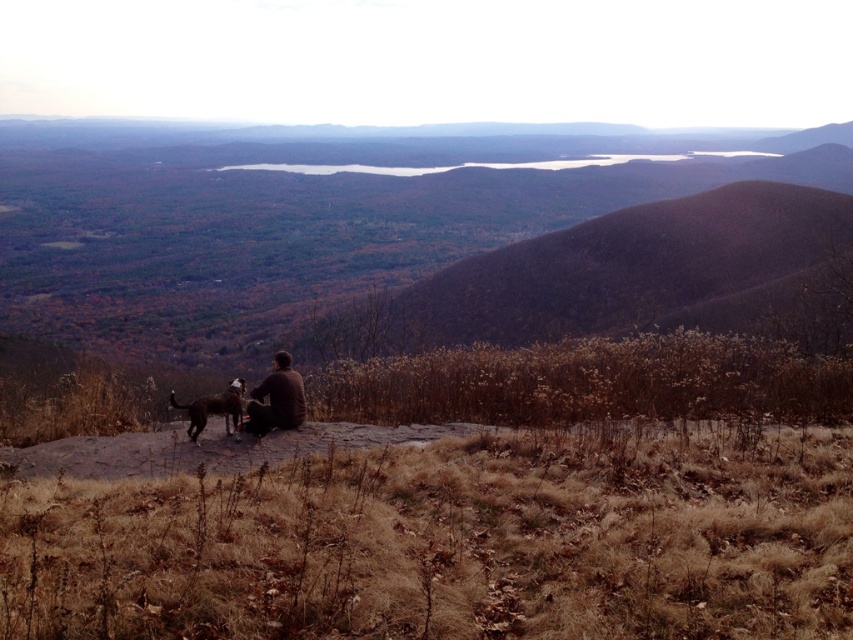
Between brown soft jacket at center and brown fur dog at center, which one is positioned lower?

brown fur dog at center

Does brown soft jacket at center lie behind brown fur dog at center?

That is True.

Between point (247, 408) and point (213, 401), which one is positioned behind?

Positioned behind is point (247, 408).

Identify the location of brown soft jacket at center. The image size is (853, 640). pos(276,397).